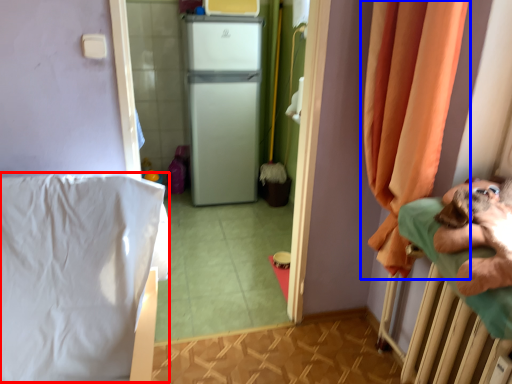
Question: Which of the following is the farthest to the observer, sheet (highlighted by a red box) or curtain (highlighted by a blue box)?

Choices:
 (A) sheet
 (B) curtain

Answer: (B)